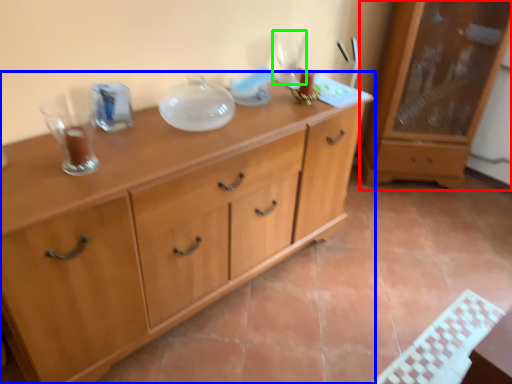
Question: Which is farther away from cabinetry (highlighted by a red box)? chest of drawers (highlighted by a blue box) or wine glass (highlighted by a green box)?

Choices:
 (A) chest of drawers
 (B) wine glass

Answer: (A)